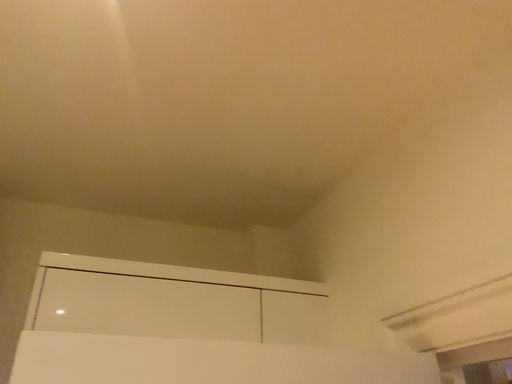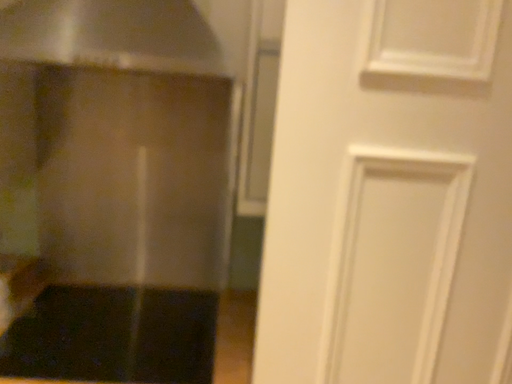
Question: How did the camera likely rotate when shooting the video?

Choices:
 (A) rotated downward
 (B) rotated upward

Answer: (A)